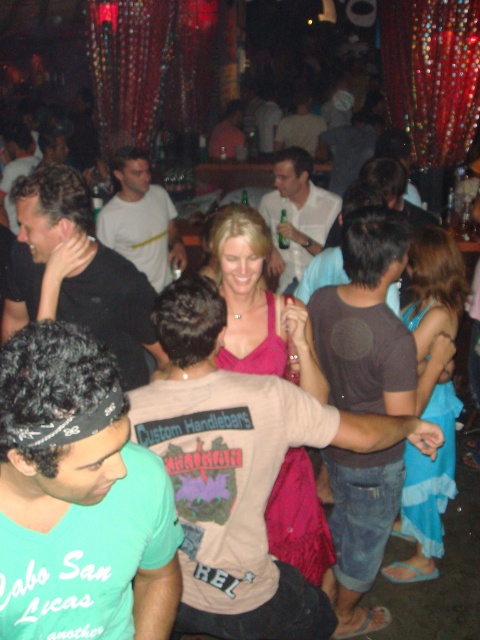
Is white matte shirt at center wider than matte white shirt at center?

No.

Does point (286, 243) come behind point (303, 93)?

No, it is not.

Which is behind, point (299, 260) or point (300, 116)?

The point (300, 116) is more distant.

Identify the location of white matte shirt at center. The width and height of the screenshot is (480, 640). (296, 216).

How distant is teal t-shirt at lower left from white matte shirt at center?

The distance of teal t-shirt at lower left from white matte shirt at center is 3.34 meters.

The width and height of the screenshot is (480, 640). Describe the element at coordinates (82, 493) in the screenshot. I see `teal t-shirt at lower left` at that location.

At what (x,y) coordinates should I click in order to perform the action: click on teal t-shirt at lower left. Please return your answer as a coordinate pair (x, y). Looking at the image, I should click on (82, 493).

Can you confirm if teal t-shirt at lower left is shorter than matte black shirt at center?

Indeed, teal t-shirt at lower left has a lesser height compared to matte black shirt at center.

From the picture: Does teal t-shirt at lower left have a greater width compared to matte black shirt at center?

No, teal t-shirt at lower left is not wider than matte black shirt at center.

Between point (63, 340) and point (212, 132), which one is positioned in front?

Point (63, 340) is more forward.

At what (x,y) coordinates should I click in order to perform the action: click on teal t-shirt at lower left. Please return your answer as a coordinate pair (x, y). This screenshot has width=480, height=640. Looking at the image, I should click on (82, 493).